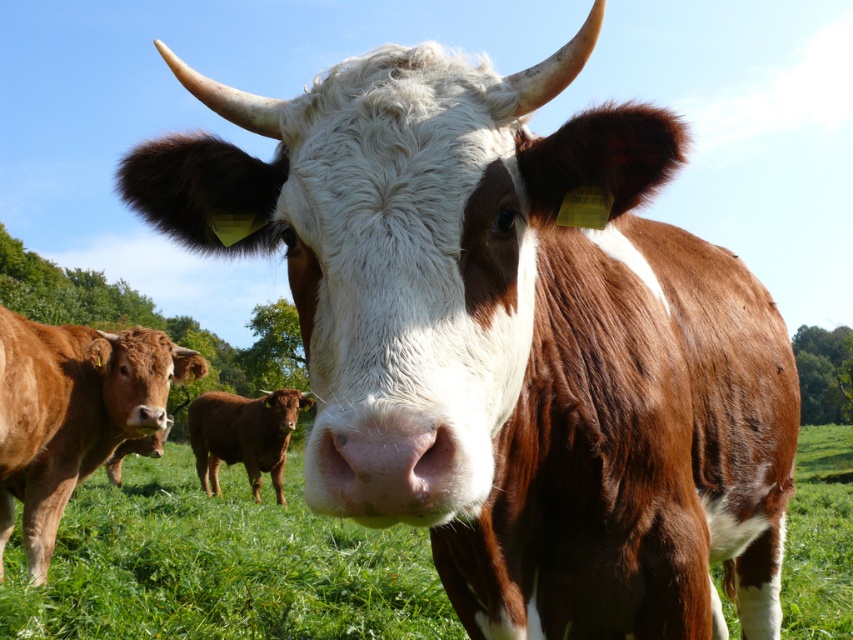
You are standing in a field and want to walk from the green grassy at center to the brown smooth cow at center. Which direction should you move to reach the cow?

The green grassy at center is wider than the brown smooth cow at center, so to reach the cow, you should move towards the center where the cow is located.